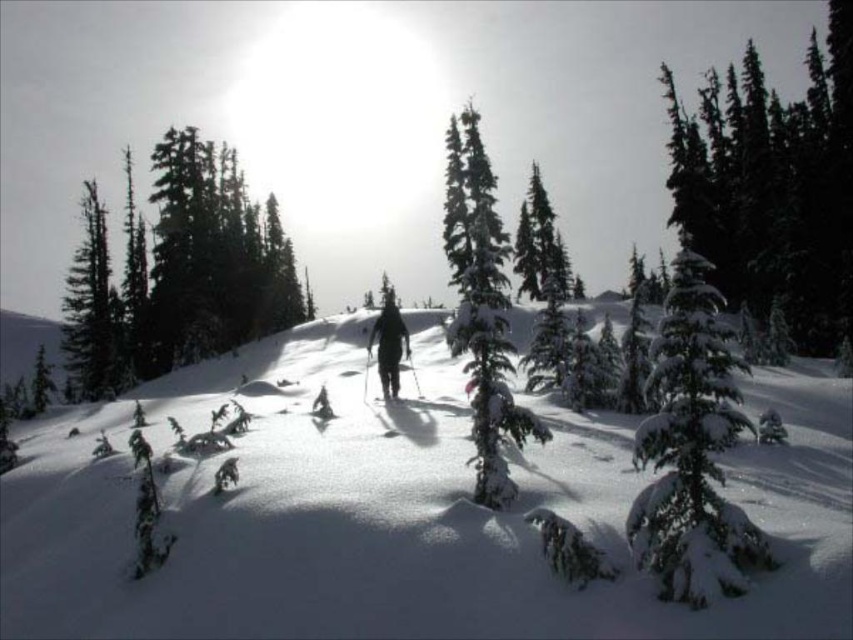
You are a hiker planning to set up a temporary shelter in the snowy forest. You have two options for locations based on the image provided. The first option is on the white fluffy snow at center, and the second is near the green matte tree at left. Considering the spatial relationship between these two areas, which location would be more stable for building the shelter and why?

The white fluffy snow at center is positioned under the green matte tree at left. Since the snow under the tree might be more compacted from the tree branches and sheltered from the wind, it would provide a more stable base for the shelter compared to the open area at the center.

You are a hiker in the winter forest scene. You see a point marked at coordinates (401, 518). What is located at that point?

The point at coordinates (401, 518) indicates white fluffy snow at center.